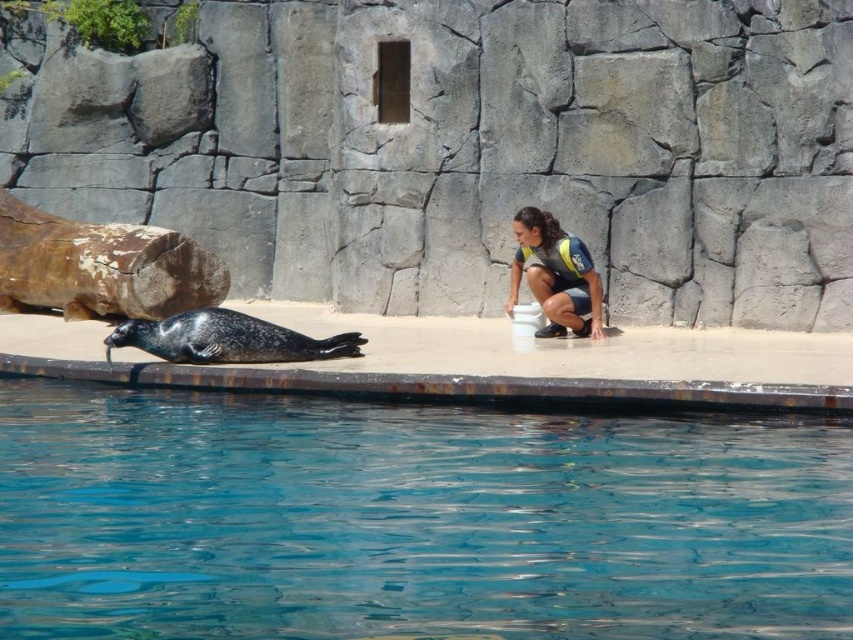
Is transparent glass water at lower center above matte black wetsuit at center?

No.

Can you confirm if transparent glass water at lower center is positioned to the right of matte black wetsuit at center?

Incorrect, transparent glass water at lower center is not on the right side of matte black wetsuit at center.

Which is in front, point (682, 598) or point (525, 230)?

Positioned in front is point (682, 598).

Identify the location of transparent glass water at lower center. (412, 518).

Who is taller, transparent glass water at lower center or gray fur seal at center?

Standing taller between the two is transparent glass water at lower center.

Can you confirm if transparent glass water at lower center is positioned to the left of gray fur seal at center?

No, transparent glass water at lower center is not to the left of gray fur seal at center.

Does point (152, 484) lie in front of point (141, 339)?

Yes, it is.

Image resolution: width=853 pixels, height=640 pixels. Find the location of `transparent glass water at lower center`. transparent glass water at lower center is located at coordinates (412, 518).

Which is more to the right, gray fur seal at center or matte black wetsuit at center?

From the viewer's perspective, matte black wetsuit at center appears more on the right side.

Does point (300, 339) come behind point (567, 253)?

No.

Where is `gray fur seal at center`? This screenshot has width=853, height=640. gray fur seal at center is located at coordinates (225, 339).